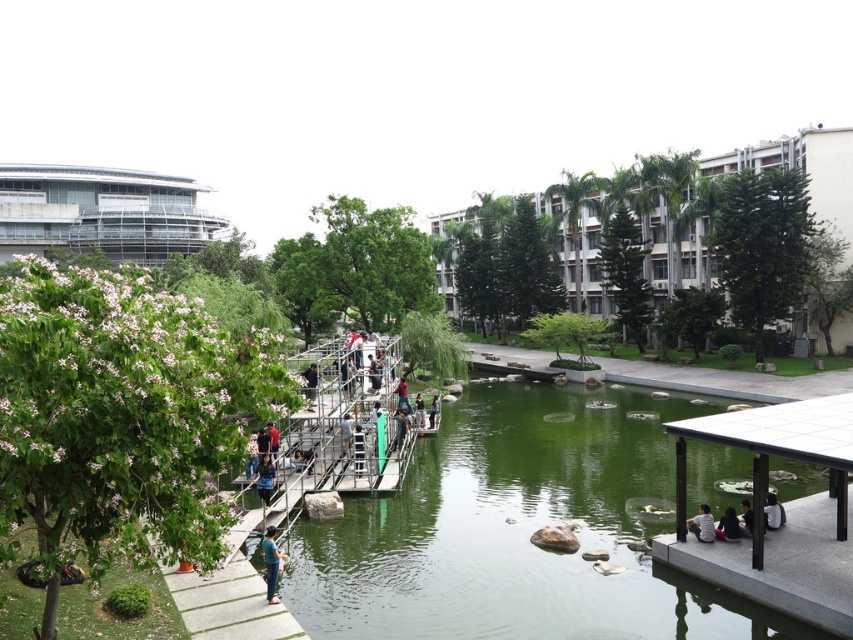
You are standing in the park and want to take a photo that includes both the point at coordinates point (743, 563) and point (711, 515). Since you know one is closer to you than the other, which point should you focus on to ensure both are in clear focus?

You should focus on the point closer to the camera, which is point (743, 563), to ensure both points are in clear focus because focusing on the closer object helps keep the background in focus as well.

You are standing in the park and want to take a photo of the green smooth water at center and the dark blue jeans at center. Which one should you focus on first to ensure both are in focus?

The green smooth water at center is closer to the viewer than the dark blue jeans at center, so you should focus on the green smooth water at center first to ensure both are in focus.

You are standing at the point with coordinates point (653, 545) in the park. You want to take a photo of the entire pond and the raised platform with metal scaffolding structure. Considering your current position, will you be able to capture the entire scene in one shot without moving? Please explain your reasoning based on the distance between you and the camera.

The point (653, 545) is 69.33 feet away from the camera. Since the camera needs to capture the entire pond and the raised platform with metal scaffolding structure, which are likely within the park area, the distance of 69.33 feet may be too far to capture the entire scene in one shot without moving closer. Moving closer would allow for a better composition and ensure all elements are included in the photo.